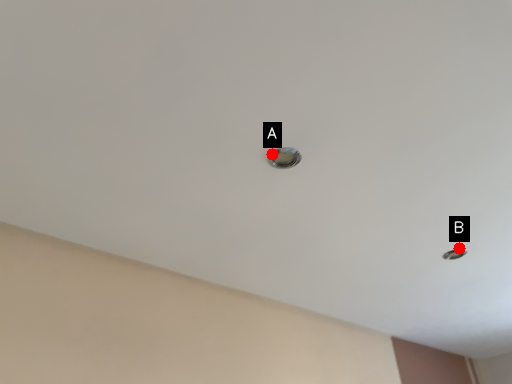
Question: Two points are circled on the image, labeled by A and B beside each circle. Which point appears farthest from the camera in this image?

Choices:
 (A) A is further
 (B) B is further

Answer: (B)